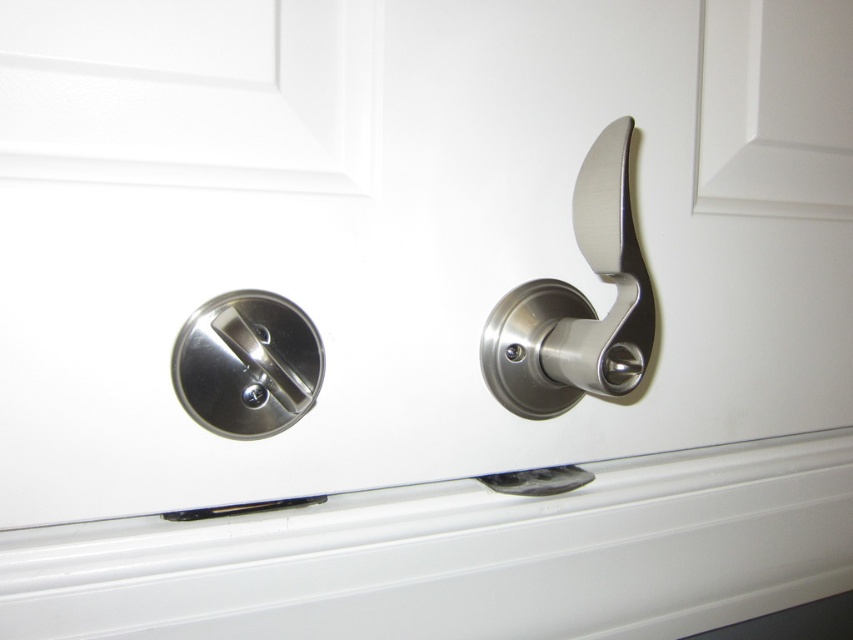
You are trying to unlock the door. The satin nickel lever at right and the satin nickel lock at center are both metallic. Which one should you turn to unlock the door?

You should turn the satin nickel lock at center to unlock the door because the satin nickel lever at right is to the right of it, indicating it might be the handle used for pulling the door, while the lock at center is the component responsible for securing the door.

You are trying to unlock a door with a key. You see a point marked at coordinates [578,304] on the door. Based on the scene description, what object is located at this point?

The point at coordinates [578,304] marks the satin nickel lever at right.